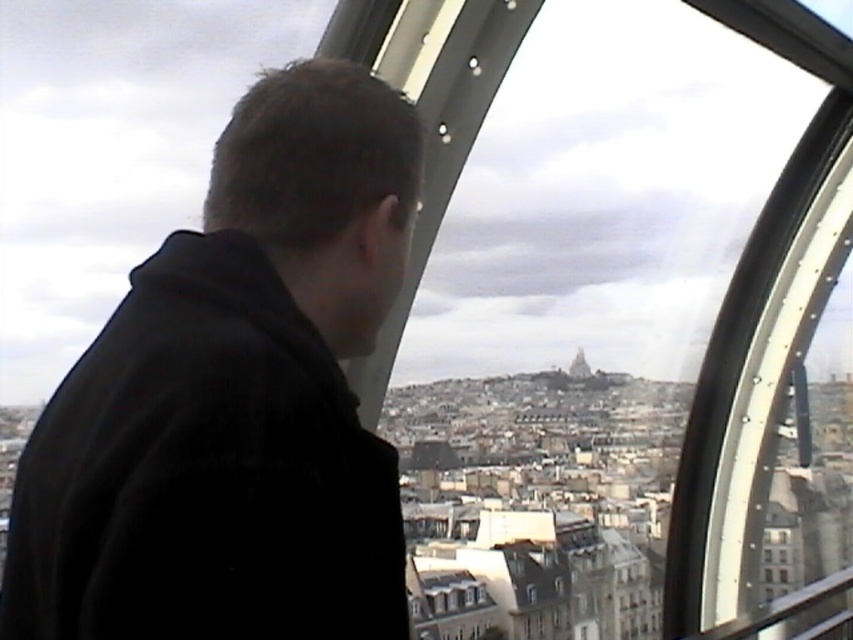
What is the exact coordinate of the smooth stone tower at center?

The smooth stone tower at center is located at point (579,365).

You are inside the observation pod and want to take a photo of the smooth stone tower at center through the transparent glass window at center. Can you see the entire tower in the frame without moving the camera?

The smooth stone tower at center is taller than the transparent glass window at center, so you cannot see the entire tower in the frame without moving the camera.

You are the person in the observation pod. You notice two points in the distance outside your pod. The first point is at coordinates point (579,358) and the second is at point (532,589). Which point is closer to you?

Point (532,589) is closer to you because point (579,358) is behind it.